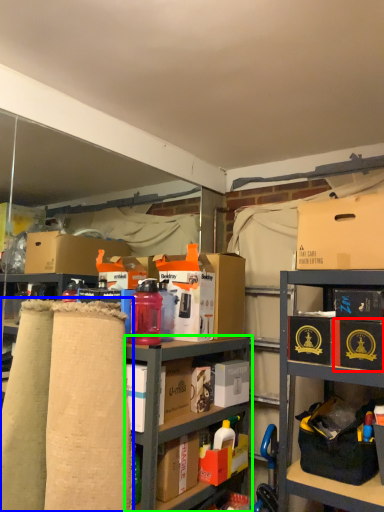
Question: Which object is positioned farthest from box (highlighted by a red box)? Select from fabric (highlighted by a blue box) and cabinetry (highlighted by a green box).

Choices:
 (A) fabric
 (B) cabinetry

Answer: (A)